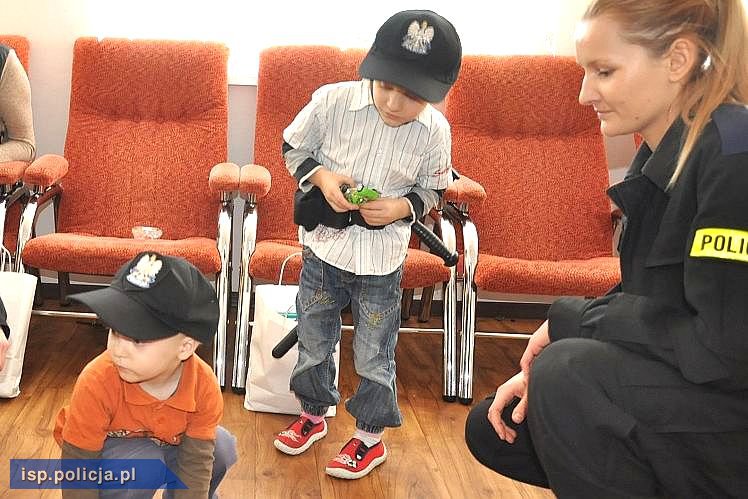
Where is `wood floor`? Image resolution: width=748 pixels, height=499 pixels. wood floor is located at coordinates (420, 464).